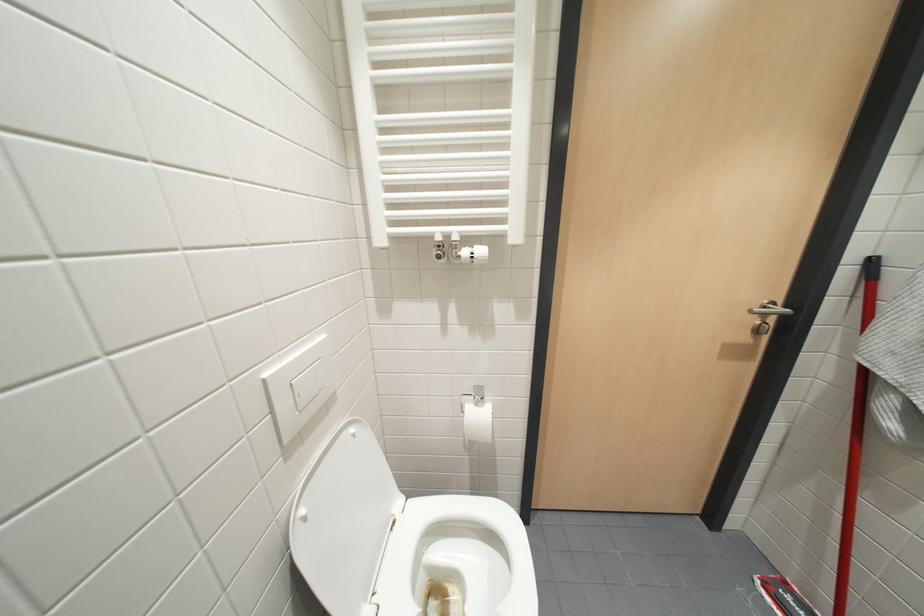
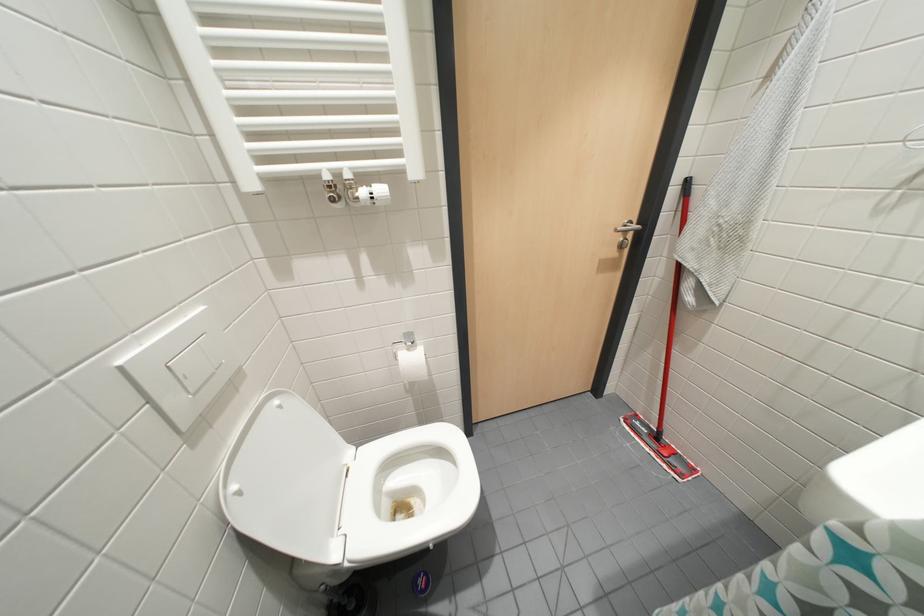
What movement of the cameraman would produce the second image?

The cameraman moved toward right, backward.